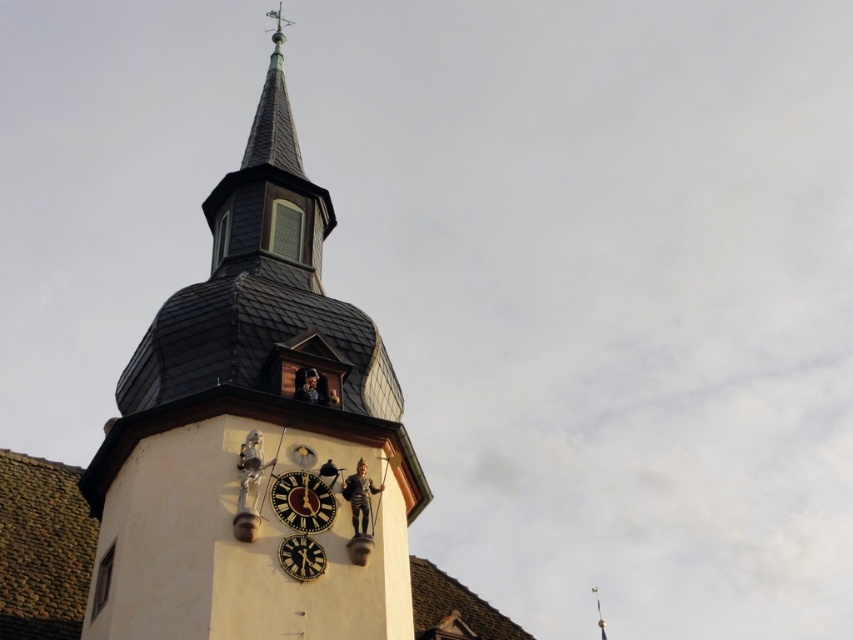
Question: Does smooth gray stone clock tower at center appear on the left side of black metal clock at center?

Choices:
 (A) no
 (B) yes

Answer: (B)

Question: Considering the real-world distances, which object is farthest from the smooth gray stone clock tower at center?

Choices:
 (A) wooden clock at center
 (B) black metal clock at center

Answer: (B)

Question: Which object appears closest to the camera in this image?

Choices:
 (A) black metal clock at center
 (B) wooden clock at center
 (C) smooth gray stone clock tower at center

Answer: (C)

Question: Which object is the farthest from the black metal clock at center?

Choices:
 (A) wooden clock at center
 (B) smooth gray stone clock tower at center

Answer: (B)

Question: Does wooden clock at center lie in front of black metal clock at center?

Choices:
 (A) no
 (B) yes

Answer: (A)

Question: Can you confirm if smooth gray stone clock tower at center is thinner than wooden clock at center?

Choices:
 (A) yes
 (B) no

Answer: (B)